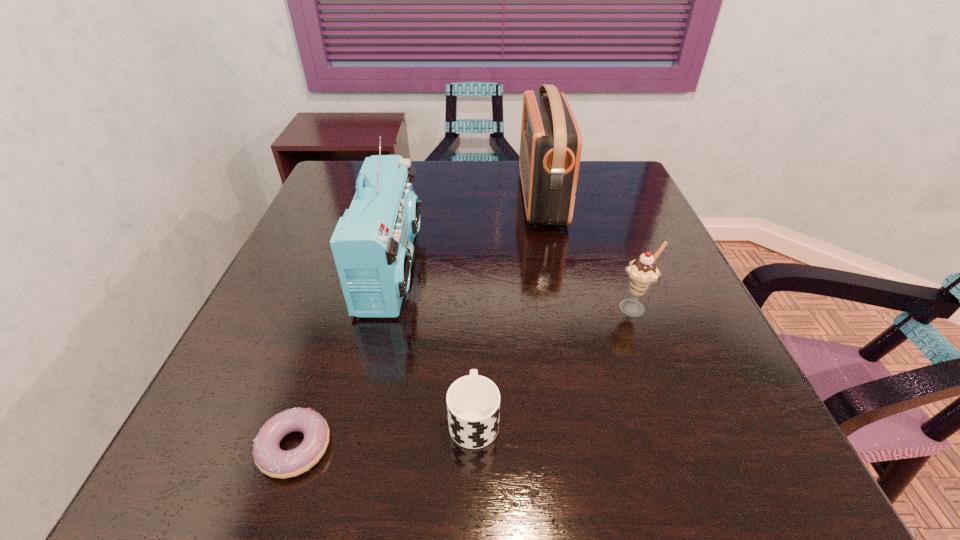
Where is `vacant space that satisfies the following two spatial constraints: 1. on the front-facing side of the left radio receiver; 2. on the side of the cup with the handle`? Image resolution: width=960 pixels, height=540 pixels. vacant space that satisfies the following two spatial constraints: 1. on the front-facing side of the left radio receiver; 2. on the side of the cup with the handle is located at coordinates (356, 418).

This screenshot has height=540, width=960. In order to click on vacant position in the image that satisfies the following two spatial constraints: 1. on the front-facing side of the left radio receiver; 2. on the left side of the icecream in this screenshot , I will do (382, 308).

I want to click on free spot that satisfies the following two spatial constraints: 1. on the front-facing side of the left radio receiver; 2. on the front side of the doughnut, so click(349, 447).

Image resolution: width=960 pixels, height=540 pixels. Identify the location of free location that satisfies the following two spatial constraints: 1. on the front-facing side of the icecream; 2. on the right side of the right radio receiver. (564, 308).

Where is `vacant region that satisfies the following two spatial constraints: 1. on the back side of the doughnut; 2. on the left side of the icecream`? vacant region that satisfies the following two spatial constraints: 1. on the back side of the doughnut; 2. on the left side of the icecream is located at coordinates (342, 308).

At what (x,y) coordinates should I click in order to perform the action: click on free location that satisfies the following two spatial constraints: 1. on the side of the third object from right to left with the handle; 2. on the left side of the rightmost object. Please return your answer as a coordinate pair (x, y). The width and height of the screenshot is (960, 540). Looking at the image, I should click on (475, 308).

Identify the location of blank area in the image that satisfies the following two spatial constraints: 1. on the side of the third object from left to right with the handle; 2. on the front-facing side of the left radio receiver. (475, 268).